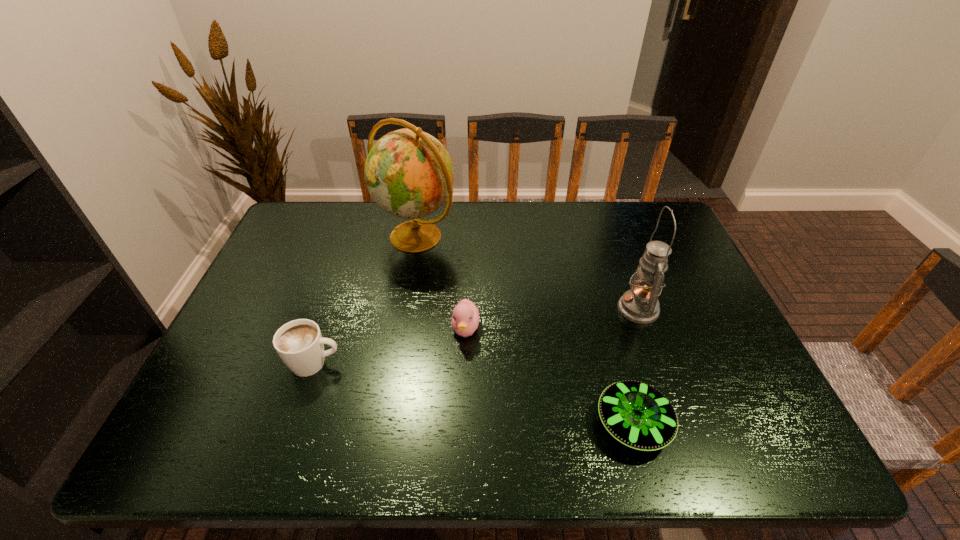
Locate an element on the screen. free region located on the front-facing side of the third object from left to right is located at coordinates (464, 377).

At what (x,y) coordinates should I click in order to perform the action: click on vacant space located 0.150m on the left of the shortest object. Please return your answer as a coordinate pair (x, y). Looking at the image, I should click on (526, 423).

This screenshot has width=960, height=540. Identify the location of object situated at the far edge. (409, 174).

The height and width of the screenshot is (540, 960). In order to click on object that is positioned at the near edge in this screenshot , I will do `click(638, 415)`.

This screenshot has height=540, width=960. Find the location of `object that is positioned at the right edge`. object that is positioned at the right edge is located at coordinates (640, 304).

Locate an element on the screen. The image size is (960, 540). vacant space at the far edge is located at coordinates (388, 226).

The width and height of the screenshot is (960, 540). What are the coordinates of `vacant region at the near edge of the desktop` in the screenshot? It's located at (496, 422).

The image size is (960, 540). Identify the location of vacant space at the left edge of the desktop. (275, 297).

This screenshot has height=540, width=960. Identify the location of vacant space at the right edge of the desktop. [x=723, y=403].

At what (x,y) coordinates should I click in order to perform the action: click on vacant region between the tallest object and the second tallest object. Please return your answer as a coordinate pair (x, y). The image size is (960, 540). Looking at the image, I should click on tap(527, 273).